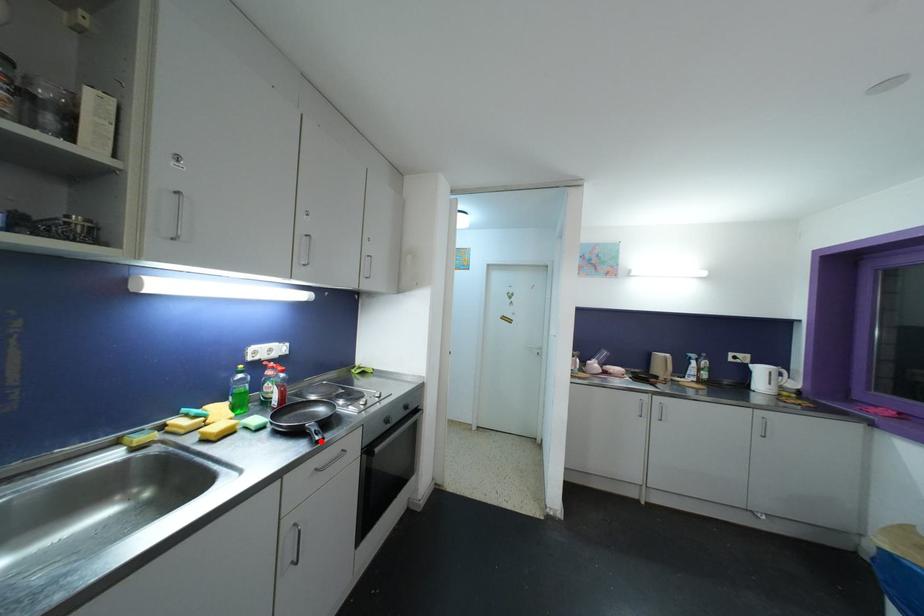
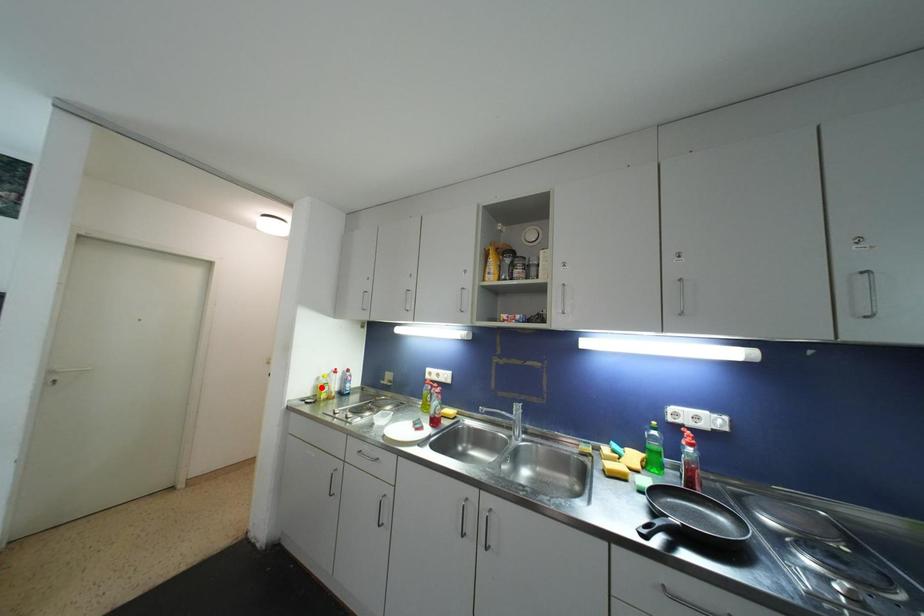
I am providing you with two images of the same scene from different viewpoints. A red point is marked on the first image and another point is marked on the second image. Do the highlighted points in image1 and image2 indicate the same real-world spot?

No